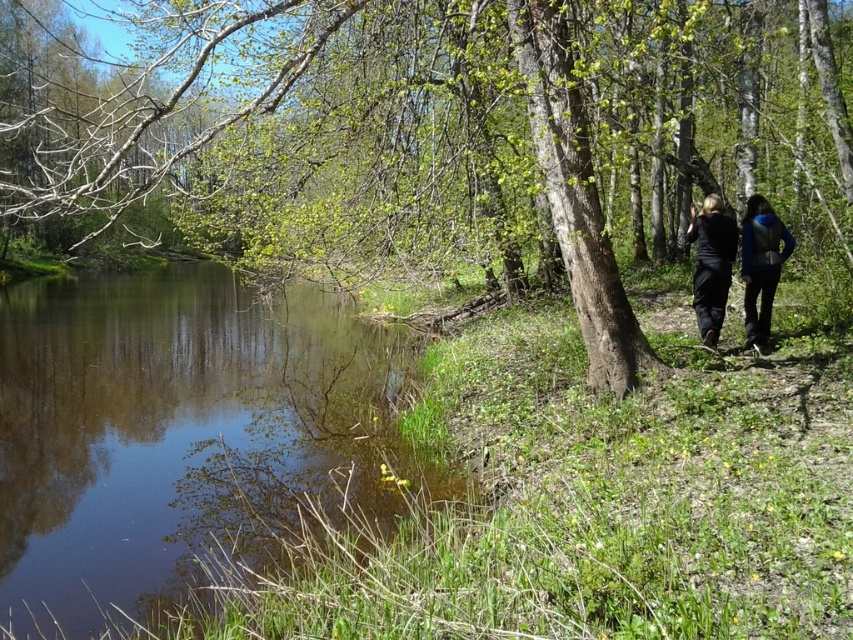
Question: Which object appears closest to the camera in this image?

Choices:
 (A) black matte pants at lower right
 (B) greenish-brown water at center-left
 (C) green rough bark tree at right
 (D) dark blue fabric jacket at right

Answer: (B)

Question: Which object is farther from the camera taking this photo?

Choices:
 (A) blue fabric jacket at right
 (B) dark blue fabric jacket at right

Answer: (B)

Question: Does green rough bark tree at right lie behind greenish-brown water at center-left?

Choices:
 (A) yes
 (B) no

Answer: (A)

Question: Does green rough bark tree at right have a larger size compared to blue fabric jacket at right?

Choices:
 (A) yes
 (B) no

Answer: (A)

Question: Among these objects, which one is nearest to the camera?

Choices:
 (A) blue fabric jacket at right
 (B) black matte pants at lower right

Answer: (A)

Question: In this image, where is blue fabric jacket at right located relative to black matte pants at lower right?

Choices:
 (A) above
 (B) below

Answer: (B)